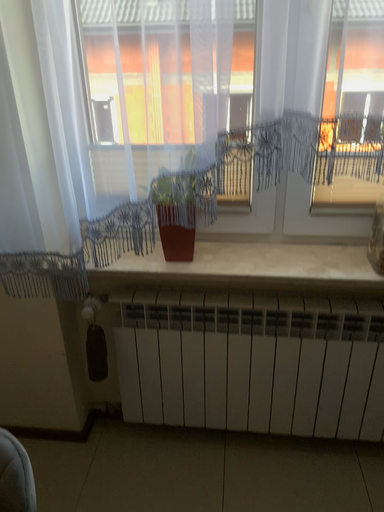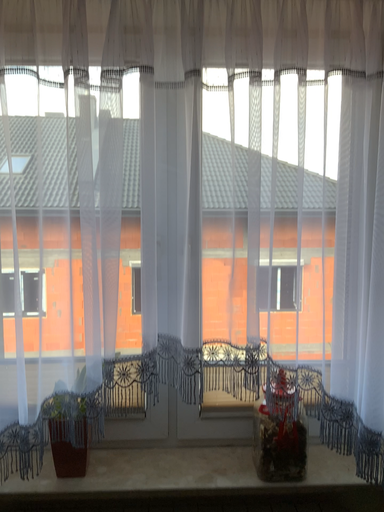
Question: Which way did the camera rotate in the video?

Choices:
 (A) rotated upward
 (B) rotated downward

Answer: (A)